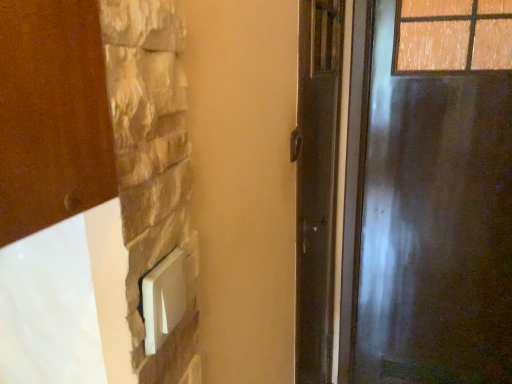
What is the approximate width of matte brown door at right?

The width of matte brown door at right is 14.07 centimeters.

What is the approximate height of matte brown door at right?

The height of matte brown door at right is 5.77 feet.

You are a GUI agent. You are given a task and a screenshot of the screen. Output one action in this format:
    pyautogui.click(x=<x>, y=<y>)
    Task: Click on the matte brown door at right
    
    Given the screenshot: What is the action you would take?
    pyautogui.click(x=425, y=218)

Describe the element at coordinates (425, 218) in the screenshot. I see `matte brown door at right` at that location.

Find the location of a particular element. This screenshot has height=384, width=512. matte brown door at right is located at coordinates (425, 218).